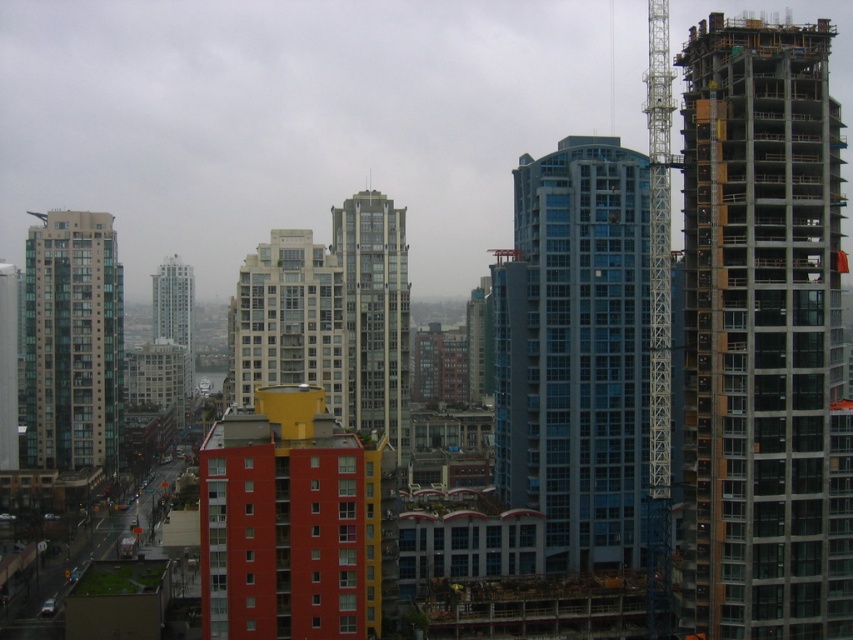
Looking at this image, you are an urban planner assessing the city layout. You need to determine which building occupies more space in the cityscape between the blue glass building at center and the matte glass building at left. Which one is larger?

The blue glass building at center is larger in size compared to the matte glass building at left, so it occupies more space in the cityscape.

You are a drone operator tasked with flying a drone between two buildings in the city. The drone has a maximum flight distance of 600 feet. You need to fly from the glassy steel building at center to the matte glass skyscraper at center. Can your drone complete this flight without needing to recharge?

The distance between the glassy steel building at center and the matte glass skyscraper at center is 632.73 feet. Since the drone has a maximum flight distance of 600 feet, it cannot complete the flight without recharging.